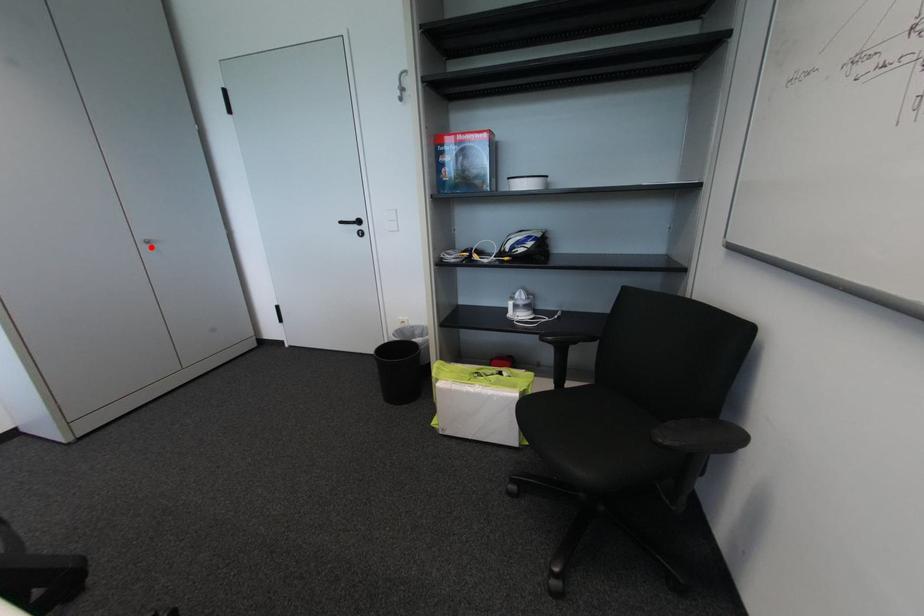
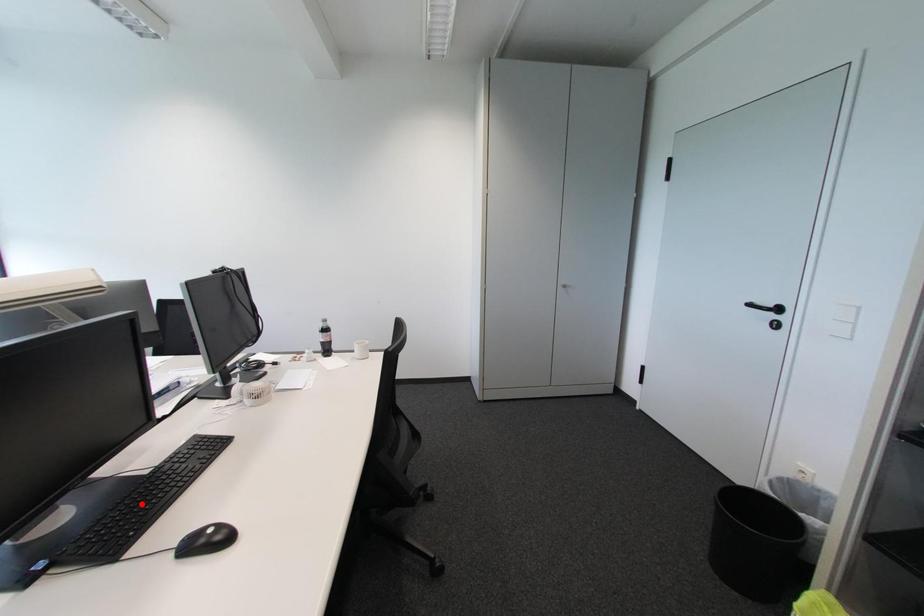
I am providing you with two images of the same scene from different viewpoints. A red point is marked on the first image and another point is marked on the second image. Are the points marked in image1 and image2 representing the same 3D position?

No